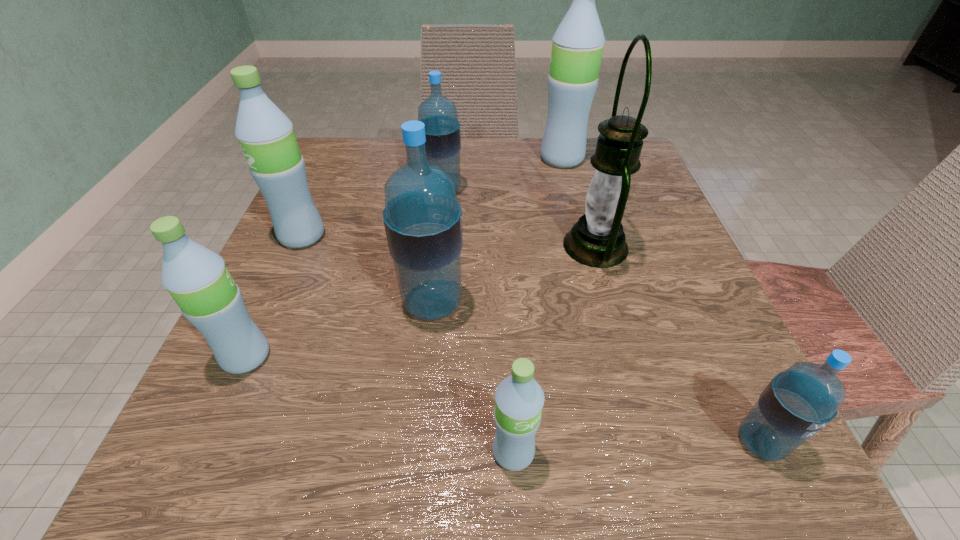
The width and height of the screenshot is (960, 540). What are the coordinates of `free space located on the left of the fourth nearest object` in the screenshot? It's located at (286, 304).

Locate an element on the screen. The width and height of the screenshot is (960, 540). vacant space located on the back of the second biggest blue water bottle is located at coordinates (445, 167).

Identify the location of vacant area situated 0.360m on the back of the third nearest water bottle. This screenshot has width=960, height=540. (318, 197).

At what (x,y) coordinates should I click in order to perform the action: click on blank space located on the back of the third water bottle from right to left. Please return your answer as a coordinate pair (x, y). This screenshot has width=960, height=540. Looking at the image, I should click on (508, 347).

The width and height of the screenshot is (960, 540). Find the location of `vacant space located on the left of the rightmost object`. vacant space located on the left of the rightmost object is located at coordinates (457, 442).

The height and width of the screenshot is (540, 960). Find the location of `lantern that is positioned at the right edge`. lantern that is positioned at the right edge is located at coordinates (597, 240).

I want to click on object at the far right corner, so click(578, 42).

Locate an element on the screen. This screenshot has width=960, height=540. object located at the near right corner is located at coordinates (799, 402).

You are a GUI agent. You are given a task and a screenshot of the screen. Output one action in this format:
    pyautogui.click(x=<x>, y=<y>)
    Task: Click on the free location at the far edge
    
    Given the screenshot: What is the action you would take?
    pyautogui.click(x=395, y=149)

This screenshot has height=540, width=960. Find the location of `vacant area at the left edge`. vacant area at the left edge is located at coordinates [300, 274].